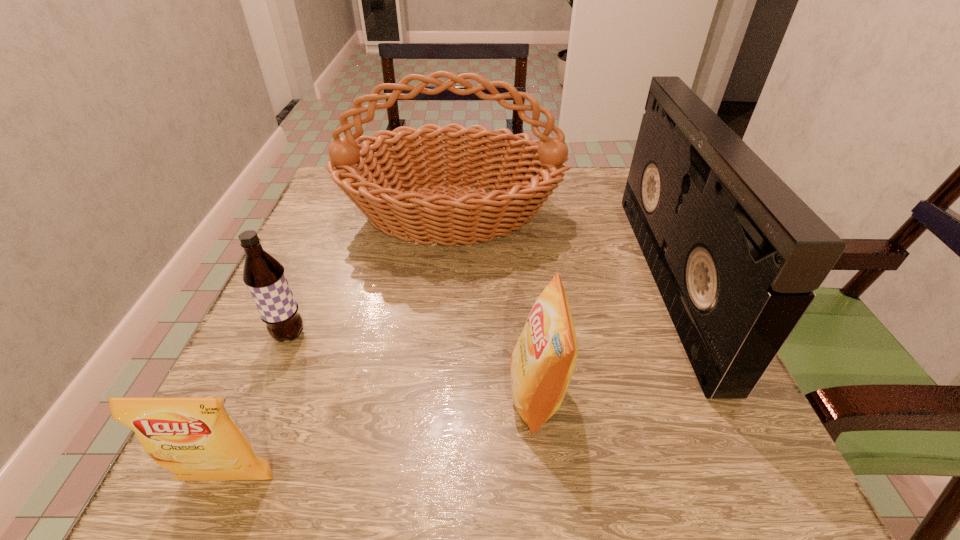
Where is `vacant area that lies between the root beer and the rightmost object`? The height and width of the screenshot is (540, 960). vacant area that lies between the root beer and the rightmost object is located at coordinates (479, 307).

The image size is (960, 540). Find the location of `unoccupied area between the nearer crisp (potato chip) and the basket`. unoccupied area between the nearer crisp (potato chip) and the basket is located at coordinates (x=340, y=347).

At what (x,y) coordinates should I click in order to perform the action: click on free space between the nearest object and the root beer. Please return your answer as a coordinate pair (x, y). Looking at the image, I should click on (259, 407).

The image size is (960, 540). Find the location of `vacant space in between the farther crisp (potato chip) and the left crisp (potato chip)`. vacant space in between the farther crisp (potato chip) and the left crisp (potato chip) is located at coordinates (383, 436).

Image resolution: width=960 pixels, height=540 pixels. Find the location of `vacant space in between the right crisp (potato chip) and the left crisp (potato chip)`. vacant space in between the right crisp (potato chip) and the left crisp (potato chip) is located at coordinates (383, 436).

This screenshot has height=540, width=960. What are the coordinates of `free point between the basket and the root beer` in the screenshot? It's located at (371, 275).

Locate an element on the screen. The width and height of the screenshot is (960, 540). blank region between the left crisp (potato chip) and the basket is located at coordinates (340, 347).

This screenshot has height=540, width=960. What are the coordinates of `vacant area between the basket and the nearest object` in the screenshot? It's located at (340, 347).

What are the coordinates of `free space between the root beer and the basket` in the screenshot? It's located at (371, 275).

Identify which object is located as the fourth nearest to the right crisp (potato chip). Please provide its 2D coordinates. Your answer should be formatted as a tuple, i.e. [(x, y)], where the tuple contains the x and y coordinates of a point satisfying the conditions above.

[(264, 276)]